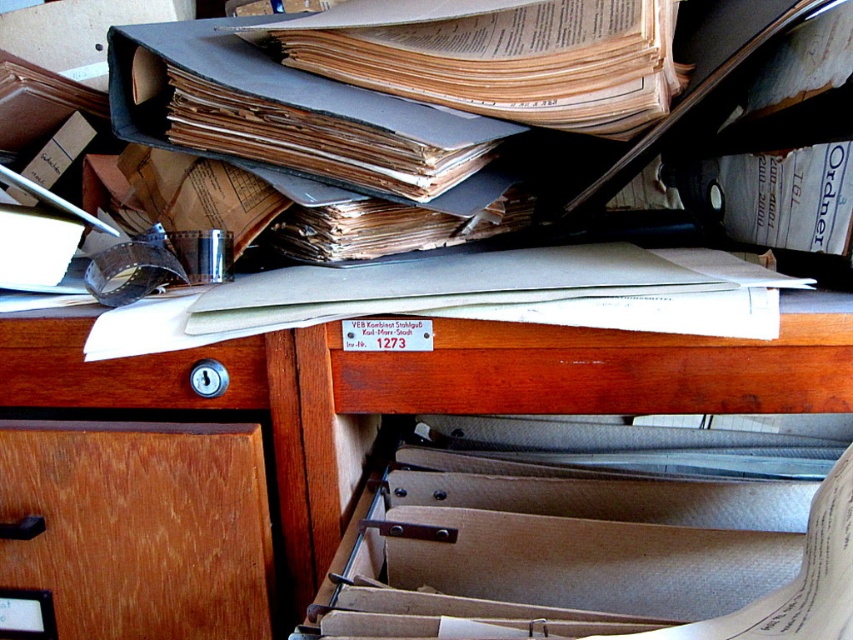
You are organizing documents in an office and need to place a new folder. The wooden desk at center and the wooden drawer at left are both available. Which one has more horizontal space for placing the folder?

The wooden desk at center is wider than the wooden drawer at left, so it has more horizontal space for placing the folder.

You are an office worker who needs to place a new folder on the wooden desk at center. However, there is a wooden drawer at lower left in the way. Can you slide the drawer out to make space?

The wooden desk at center is positioned over the wooden drawer at lower left, so you can slide the wooden drawer at lower left out to create space on the wooden desk at center.